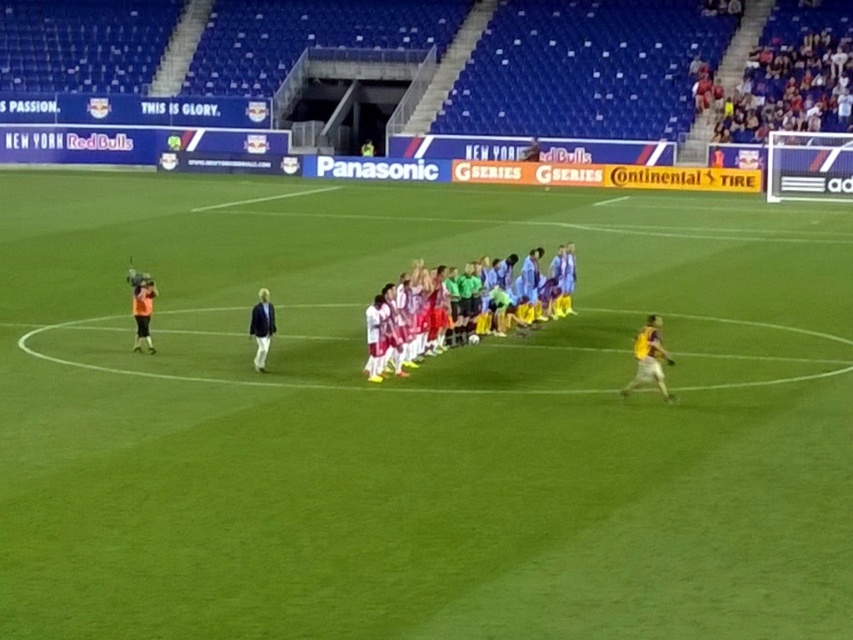
Is white jersey at center above yellow jersey at right?

Indeed, white jersey at center is positioned over yellow jersey at right.

Measure the distance between white jersey at center and yellow jersey at right.

A distance of 3.88 meters exists between white jersey at center and yellow jersey at right.

Is point (566, 312) positioned before point (656, 356)?

That is False.

The image size is (853, 640). What are the coordinates of `white jersey at center` in the screenshot? It's located at (486, 305).

In the scene shown: Is green grass field at center closer to the viewer compared to white jersey at center?

Yes, green grass field at center is in front of white jersey at center.

Can you confirm if green grass field at center is wider than white jersey at center?

Indeed, green grass field at center has a greater width compared to white jersey at center.

The image size is (853, 640). I want to click on green grass field at center, so click(418, 419).

Describe the element at coordinates (418, 419) in the screenshot. The image size is (853, 640). I see `green grass field at center` at that location.

Between green grass field at center and dark blue jacket at center, which one appears on the right side from the viewer's perspective?

Positioned to the right is green grass field at center.

Is point (335, 385) closer to viewer compared to point (270, 321)?

That is True.

Locate an element on the screen. green grass field at center is located at coordinates point(418,419).